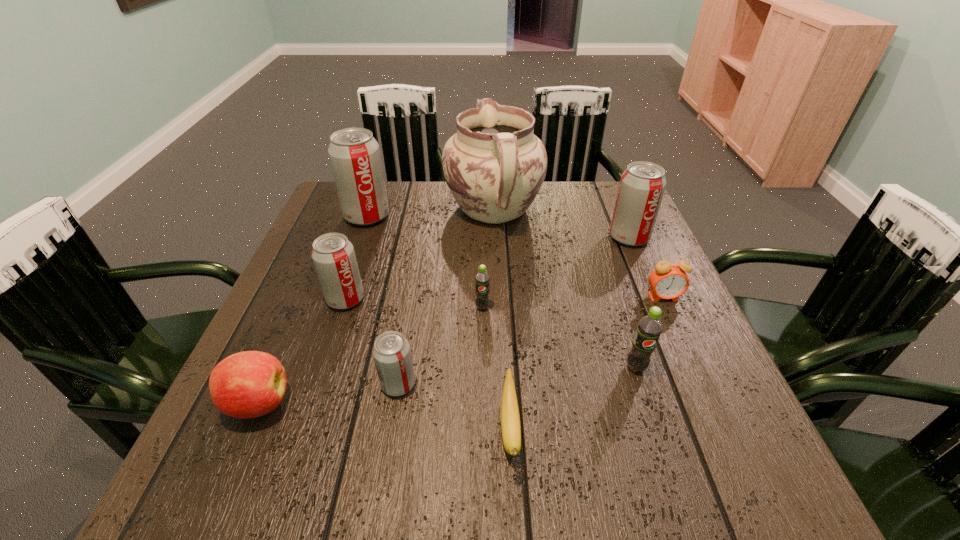
Find the location of `free area in between the alarm clock and the red apple`. free area in between the alarm clock and the red apple is located at coordinates (461, 350).

This screenshot has width=960, height=540. Find the location of `free space between the pink alarm clock and the second tallest soda can`. free space between the pink alarm clock and the second tallest soda can is located at coordinates (646, 267).

The image size is (960, 540). In order to click on free space between the shortest object and the right green soda in this screenshot , I will do `click(573, 399)`.

At what (x,y) coordinates should I click in order to perform the action: click on empty space that is in between the fifth soda can from left to right and the tallest soda can. Please return your answer as a coordinate pair (x, y). Image resolution: width=960 pixels, height=540 pixels. Looking at the image, I should click on (501, 292).

Where is `empty space that is in between the second smallest gray soda can and the third tallest object`? This screenshot has width=960, height=540. empty space that is in between the second smallest gray soda can and the third tallest object is located at coordinates (487, 268).

Identify which object is the ninth closest to the red apple. Please provide its 2D coordinates. Your answer should be formatted as a tuple, i.e. [(x, y)], where the tuple contains the x and y coordinates of a point satisfying the conditions above.

[(642, 185)]

I want to click on the fifth closest object to the purple pitcher, so click(668, 280).

Where is `soda can that can be found as the second closest to the pitcher`? The width and height of the screenshot is (960, 540). soda can that can be found as the second closest to the pitcher is located at coordinates (642, 185).

The image size is (960, 540). Find the location of `soda can that stands as the closest to the red apple`. soda can that stands as the closest to the red apple is located at coordinates (391, 351).

Select which gray soda can appears as the third closest to the ninth shortest object. Please provide its 2D coordinates. Your answer should be formatted as a tuple, i.e. [(x, y)], where the tuple contains the x and y coordinates of a point satisfying the conditions above.

[(642, 185)]